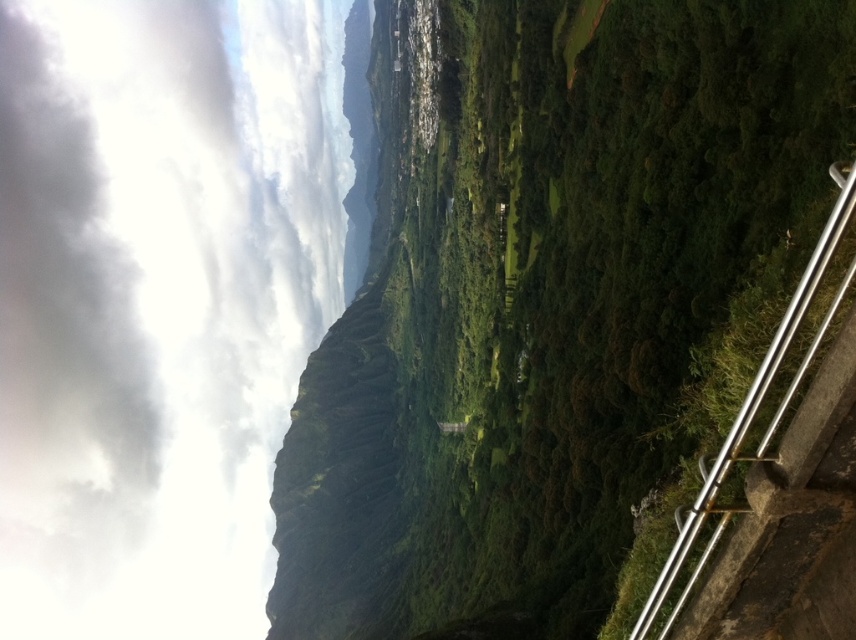
Is green leafy vegetation at right bigger than silver metallic rail at right?

Indeed, green leafy vegetation at right has a larger size compared to silver metallic rail at right.

Which of these two, green leafy vegetation at right or silver metallic rail at right, stands shorter?

silver metallic rail at right is shorter.

What do you see at coordinates (586, 264) in the screenshot? I see `green leafy vegetation at right` at bounding box center [586, 264].

This screenshot has height=640, width=856. In order to click on green leafy vegetation at right in this screenshot , I will do tap(586, 264).